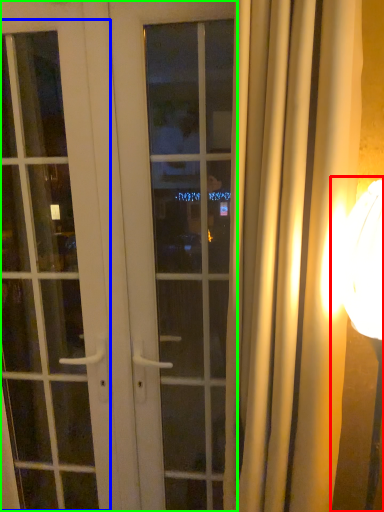
Question: Which is nearer to the table lamp (highlighted by a red box)? screen door (highlighted by a blue box) or door (highlighted by a green box).

Choices:
 (A) screen door
 (B) door

Answer: (B)